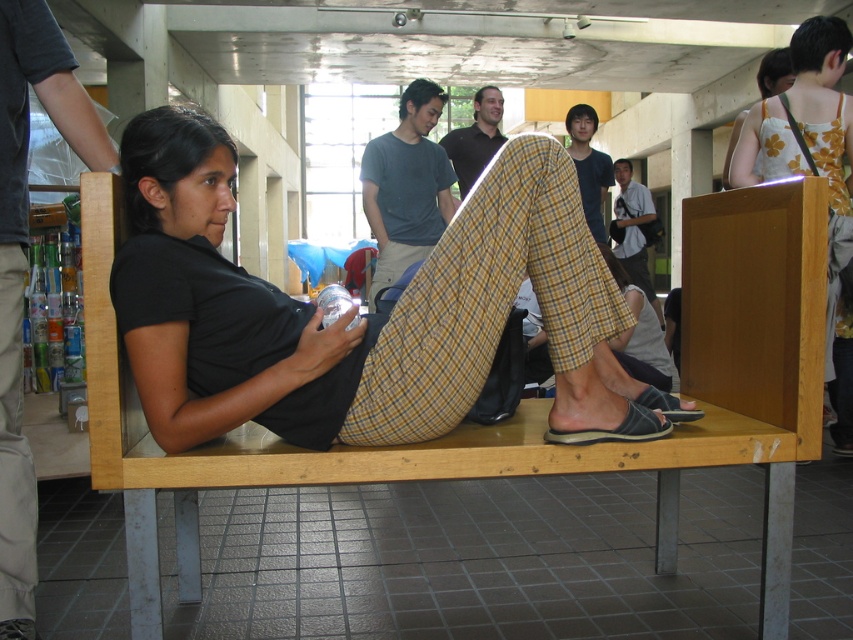
Question: Is wooden bench at center above matte black shirt at center?

Choices:
 (A) no
 (B) yes

Answer: (A)

Question: Does floral print dress at upper right appear on the left side of black rubber sandal at lower right?

Choices:
 (A) no
 (B) yes

Answer: (A)

Question: Which point is farther from the camera taking this photo?

Choices:
 (A) (474, 129)
 (B) (614, 163)

Answer: (B)

Question: Which point appears closest to the camera in this image?

Choices:
 (A) (94, 410)
 (B) (62, 81)
 (C) (434, 189)

Answer: (A)

Question: Which object is farther from the camera taking this photo?

Choices:
 (A) wooden bench at center
 (B) khaki cotton pants at center
 (C) floral print dress at upper right
 (D) matte black shirt at center

Answer: (D)

Question: Can you confirm if wooden bench at center is positioned to the right of dark gray t-shirt at center?

Choices:
 (A) yes
 (B) no

Answer: (A)